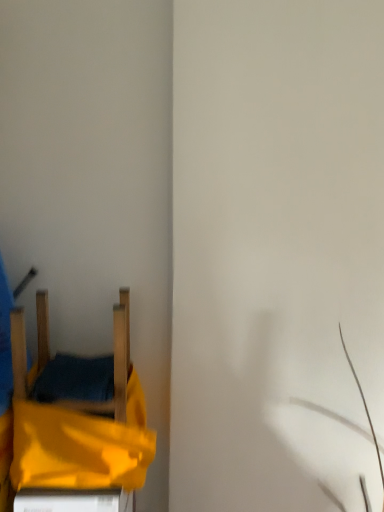
What do you see at coordinates (78, 412) in the screenshot? I see `yellow fabric bed at lower left` at bounding box center [78, 412].

Find the location of a particular element. Image resolution: width=384 pixels, height=512 pixels. yellow fabric bed at lower left is located at coordinates (78, 412).

What do you see at coordinates (75, 366) in the screenshot? This screenshot has height=512, width=384. I see `wooden chair at left` at bounding box center [75, 366].

Locate an element on the screen. wooden chair at left is located at coordinates click(x=75, y=366).

At what (x,y) coordinates should I click in order to perform the action: click on yellow fabric bed at lower left. Please return your answer as a coordinate pair (x, y). Image resolution: width=384 pixels, height=512 pixels. Looking at the image, I should click on (78, 412).

Visually, is yellow fabric bed at lower left positioned to the left or to the right of wooden chair at left?

In the image, yellow fabric bed at lower left appears on the right side of wooden chair at left.

Relative to wooden chair at left, is yellow fabric bed at lower left in front or behind?

Clearly, yellow fabric bed at lower left is in front of wooden chair at left.

Does point (98, 392) come in front of point (123, 397)?

Yes, point (98, 392) is in front of point (123, 397).

From the image's perspective, is yellow fabric bed at lower left located beneath wooden chair at left?

Yes, from the image's perspective, yellow fabric bed at lower left is beneath wooden chair at left.

From a real-world perspective, does yellow fabric bed at lower left stand above wooden chair at left?

No.

Based on the photo, considering the sizes of objects yellow fabric bed at lower left and wooden chair at left in the image provided, who is wider, yellow fabric bed at lower left or wooden chair at left?

With larger width is yellow fabric bed at lower left.

Is yellow fabric bed at lower left shorter than wooden chair at left?

Yes.

Which of these two, yellow fabric bed at lower left or wooden chair at left, is bigger?

yellow fabric bed at lower left.

Is yellow fabric bed at lower left outside of wooden chair at left?

Yes, yellow fabric bed at lower left is outside of wooden chair at left.

Is yellow fabric bed at lower left not close to wooden chair at left?

Actually, yellow fabric bed at lower left and wooden chair at left are a little close together.

Is yellow fabric bed at lower left oriented away from wooden chair at left?

No.

How much distance is there between yellow fabric bed at lower left and wooden chair at left?

yellow fabric bed at lower left and wooden chair at left are 4.30 centimeters apart from each other.

In the image, there is a wooden chair at left. At what (x,y) coordinates should I click in order to perform the action: click on bed below it (from the image's perspective). Please return your answer as a coordinate pair (x, y). Image resolution: width=384 pixels, height=512 pixels. Looking at the image, I should click on (78, 412).

Does wooden chair at left appear on the left side of yellow fabric bed at lower left?

Yes, wooden chair at left is to the left of yellow fabric bed at lower left.

Which is behind, wooden chair at left or yellow fabric bed at lower left?

wooden chair at left is behind.

Is point (23, 336) positioned behind point (57, 474)?

Yes, point (23, 336) is farther from viewer.

From the image's perspective, is wooden chair at left on yellow fabric bed at lower left?

Yes.

From a real-world perspective, which object rests below the other?

yellow fabric bed at lower left, from a real-world perspective.

Is wooden chair at left wider than yellow fabric bed at lower left?

No.

Does wooden chair at left have a greater height compared to yellow fabric bed at lower left?

Correct, wooden chair at left is much taller as yellow fabric bed at lower left.

Which of these two, wooden chair at left or yellow fabric bed at lower left, is bigger?

Bigger between the two is yellow fabric bed at lower left.

Could yellow fabric bed at lower left be considered to be inside wooden chair at left?

No, yellow fabric bed at lower left is located outside of wooden chair at left.

Is there a large distance between wooden chair at left and yellow fabric bed at lower left?

No, wooden chair at left is not far from yellow fabric bed at lower left.

Could you tell me if wooden chair at left is turned towards yellow fabric bed at lower left?

No, wooden chair at left is not facing towards yellow fabric bed at lower left.

This screenshot has width=384, height=512. I want to click on furniture that is behind the yellow fabric bed at lower left, so click(x=75, y=366).

You are a GUI agent. You are given a task and a screenshot of the screen. Output one action in this format:
    pyautogui.click(x=<x>, y=<y>)
    Task: Click on the bed below the wooden chair at left (from the image's perspective)
    The width and height of the screenshot is (384, 512).
    Given the screenshot: What is the action you would take?
    pyautogui.click(x=78, y=412)

Identify the location of furniture above the yellow fabric bed at lower left (from a real-world perspective). The height and width of the screenshot is (512, 384). (75, 366).